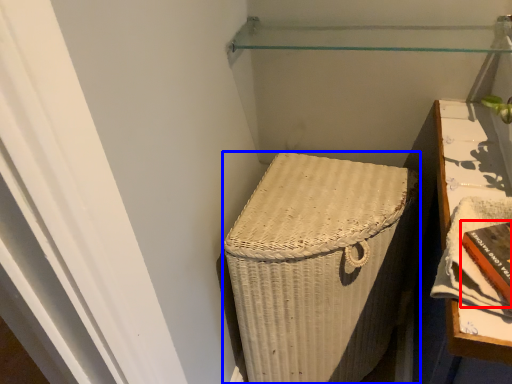
Question: Which of the following is the closest to the observer, book (highlighted by a red box) or furniture (highlighted by a blue box)?

Choices:
 (A) book
 (B) furniture

Answer: (A)